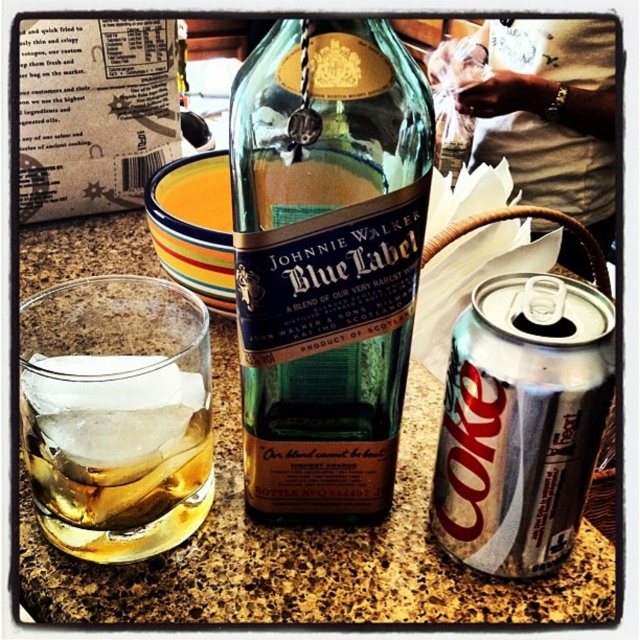
At what (x,y) coordinates should I click in order to perform the action: click on green glass bottle at center. Please return your answer as a coordinate pair (x, y). Looking at the image, I should click on (326, 260).

Is green glass bottle at center below translucent glass at lower left?

No.

Is point (292, 461) positioned in front of point (106, 504)?

No, it is behind (106, 504).

Where is `green glass bottle at center`? The image size is (640, 640). green glass bottle at center is located at coordinates (326, 260).

Is point (365, 364) positioned after point (460, 422)?

Yes.

What do you see at coordinates (326, 260) in the screenshot? I see `green glass bottle at center` at bounding box center [326, 260].

This screenshot has width=640, height=640. In order to click on green glass bottle at center in this screenshot , I will do `click(326, 260)`.

Is translucent glass at lower left closer to the viewer compared to silver metallic can at right?

That is False.

This screenshot has width=640, height=640. Describe the element at coordinates (116, 413) in the screenshot. I see `translucent glass at lower left` at that location.

You are a GUI agent. You are given a task and a screenshot of the screen. Output one action in this format:
    pyautogui.click(x=<x>, y=<y>)
    Task: Click on the translucent glass at lower left
    
    Given the screenshot: What is the action you would take?
    pyautogui.click(x=116, y=413)